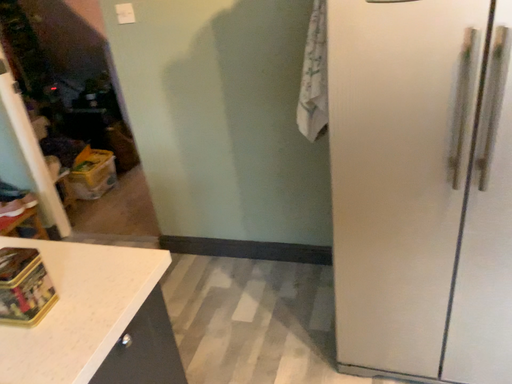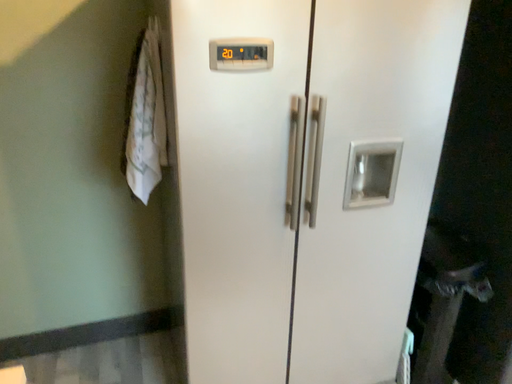
Question: Which way did the camera rotate in the video?

Choices:
 (A) rotated left
 (B) rotated right

Answer: (B)